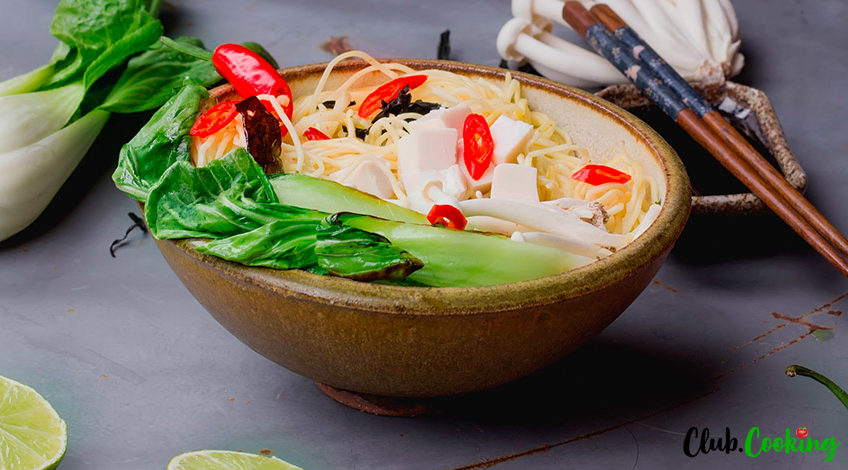
Find the location of a particular element. Image resolution: width=848 pixels, height=470 pixels. brown bowl is located at coordinates (516, 331).